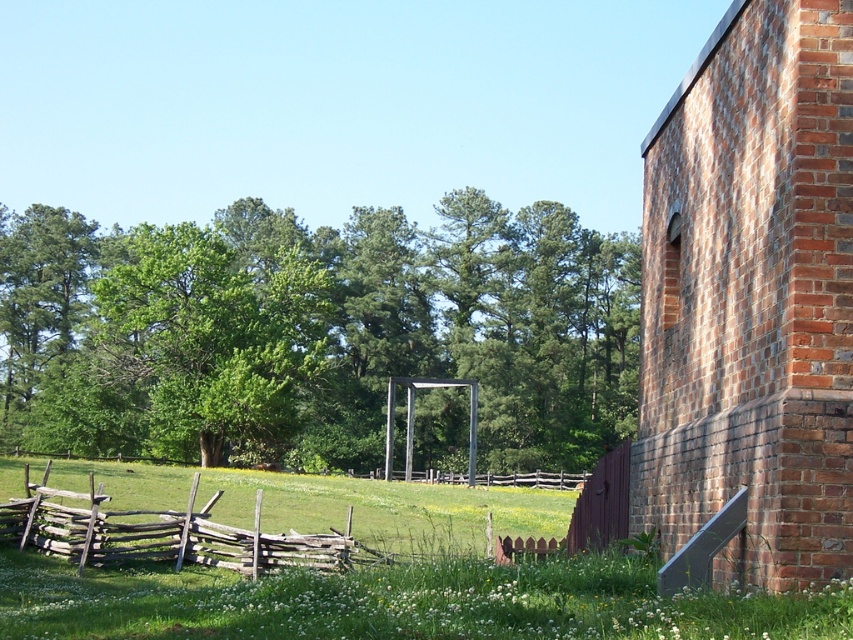
You are standing at the center of the grassy field and want to reach the brick chimney at right. Which direction should you head towards?

The brick chimney at right is located at point (x=752, y=296), so you should head towards the right direction to reach it.

You are a painter setting up your easel in the rural scene. You want to paint both the weathered wood fence at lower left and the brown wooden fence at center. Which fence should you focus on first if you want to paint the smaller one first?

The weathered wood fence at lower left is smaller than the brown wooden fence at center, so you should focus on painting the weathered wood fence at lower left first.

You are standing in the middle of the field looking towards the brick chimney at right. Which direction should you walk to reach the brown wooden fence at lower right?

You should walk to the left because the brick chimney at right is to the right of the brown wooden fence at lower right, meaning the fence is positioned to the left of the chimney from your perspective.